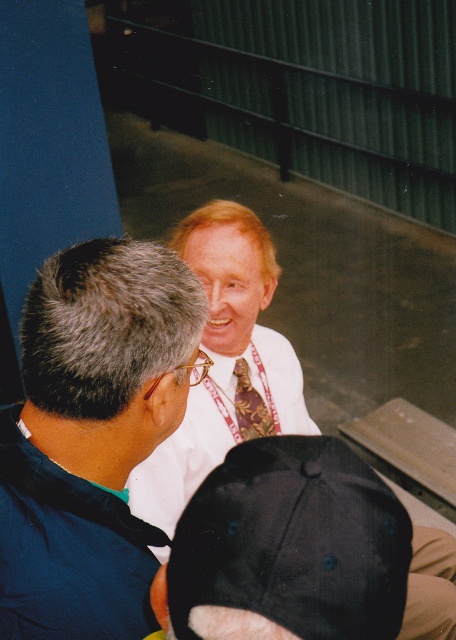
Question: Does white fabric at center appear over white silk shirt at center?

Choices:
 (A) yes
 (B) no

Answer: (A)

Question: Is white fabric at center smaller than white satin dress shirt at center?

Choices:
 (A) yes
 (B) no

Answer: (A)

Question: Estimate the real-world distances between objects in this image. Which object is closer to the white fabric at center?

Choices:
 (A) white satin dress shirt at center
 (B) black fabric baseball cap at lower center

Answer: (B)

Question: Can you confirm if black fabric baseball cap at lower center is positioned above brown patterned tie at center?

Choices:
 (A) no
 (B) yes

Answer: (A)

Question: Based on their relative distances, which object is nearer to the brown patterned tie at center?

Choices:
 (A) white silk shirt at center
 (B) white fabric at center
 (C) white satin dress shirt at center
 (D) black fabric baseball cap at lower center

Answer: (C)

Question: Which of the following is the farthest from the observer?

Choices:
 (A) (264, 412)
 (B) (31, 525)
 (C) (202, 451)
 (D) (270, 253)

Answer: (A)